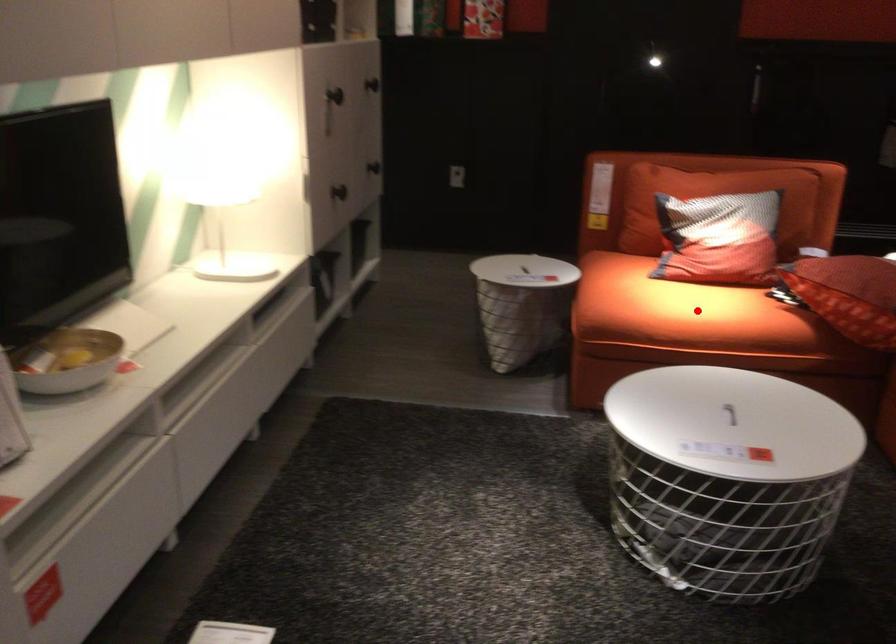
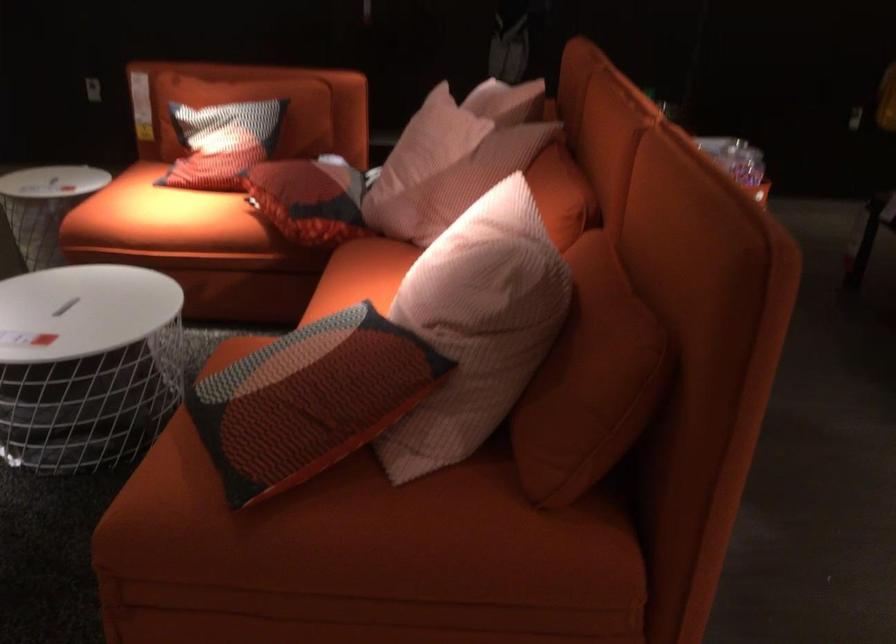
Find the pixel in the second image that matches the highlighted location in the first image.

(160, 216)